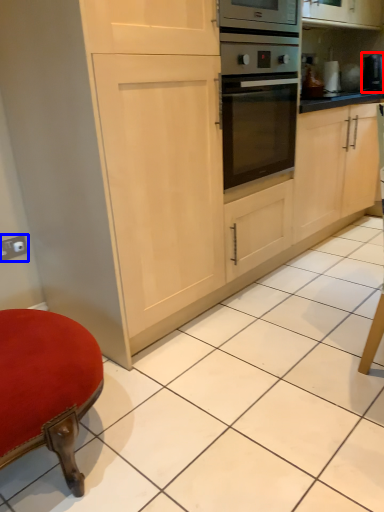
Question: Which of the following is the closest to the observer, appliance (highlighted by a red box) or electric outlet (highlighted by a blue box)?

Choices:
 (A) appliance
 (B) electric outlet

Answer: (B)